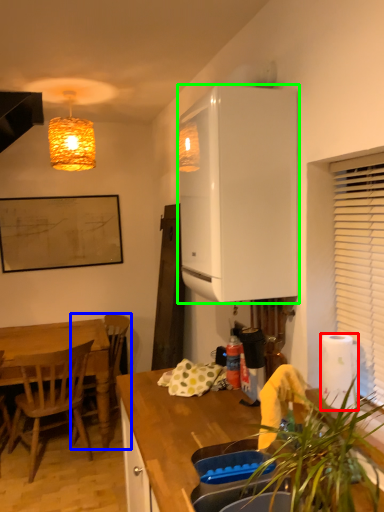
Question: Which is nearer to the paper towel (highlighted by a red box)? chair (highlighted by a blue box) or cabinetry (highlighted by a green box).

Choices:
 (A) chair
 (B) cabinetry

Answer: (B)